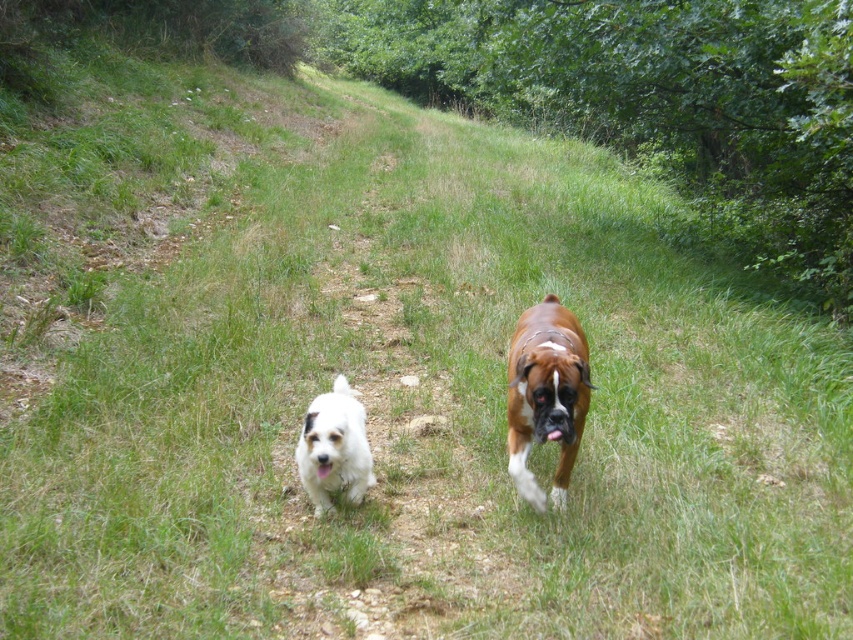
From the picture: You are a hiker carrying a backpack that can only fit one dog. You need to choose between the brown glossy dog at center and the white fluffy dog at center to bring with you. Which dog should you choose based on their sizes?

The brown glossy dog at center is larger than the white fluffy dog at center, so you should choose the white fluffy dog at center because it is smaller and easier to carry in your backpack.

You are a photographer positioned on the elevated path. You want to take a photo of the brown glossy dog at center and the white fluffy dog at center. Based on their positions, which dog should you focus on first to ensure both are in the frame?

The brown glossy dog at center is above the white fluffy dog at center, so you should focus on the brown glossy dog at center first to ensure both are in the frame.

You are a photographer standing at the starting point of the dirt path. You want to take a photo of the brown glossy dog at center. Where should you position yourself to capture the dog in the frame?

To capture the brown glossy dog at center in the frame, position yourself at the starting point of the dirt path and aim your camera towards the coordinates 0.617 on the x and 0.641 on the y axis, as that is the 2D location of the brown glossy dog at center.